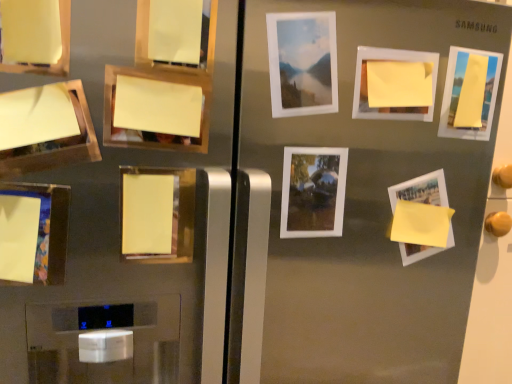
How much space does yellow matte paper at center, which appears as the fourth picture frame when viewed from the left, occupy horizontally?

It is 0.47 inches.

This screenshot has height=384, width=512. I want to click on yellow paper at upper left, arranged as the 7th picture frame when viewed from the right, so click(156, 109).

How much space does yellow matte paper at bottom right, the second picture frame when ordered from right to left, occupy vertically?

The height of yellow matte paper at bottom right, the second picture frame when ordered from right to left, is 18.59 centimeters.

This screenshot has height=384, width=512. Describe the element at coordinates (420, 192) in the screenshot. I see `yellow matte paper at bottom right, positioned as the tenth picture frame in left-to-right order` at that location.

The height and width of the screenshot is (384, 512). Find the location of `matte yellow paper at upper left, the ninth picture frame from the right`. matte yellow paper at upper left, the ninth picture frame from the right is located at coordinates (62, 49).

Where is `yellow matte paper at upper right, the 9th picture frame in the left-to-right sequence`? This screenshot has height=384, width=512. yellow matte paper at upper right, the 9th picture frame in the left-to-right sequence is located at coordinates (394, 84).

In order to click on yellow matte paper at center, which appears as the fourth picture frame when viewed from the left in this screenshot , I will do `click(157, 214)`.

Between matte yellow paper at upper left, the ninth picture frame from the right, and matte yellow paper at lower left, arranged as the 1th picture frame when viewed from the left, which one has smaller size?

matte yellow paper at lower left, arranged as the 1th picture frame when viewed from the left.

From a real-world perspective, is matte yellow paper at upper left, the ninth picture frame from the right, over matte yellow paper at lower left, which appears as the 11th picture frame when viewed from the right?

Yes, from a real-world perspective, matte yellow paper at upper left, the ninth picture frame from the right, is over matte yellow paper at lower left, which appears as the 11th picture frame when viewed from the right

At what (x,y) coordinates should I click in order to perform the action: click on the 9th picture frame positioned above the matte yellow paper at lower left, which appears as the 11th picture frame when viewed from the right (from a real-world perspective). Please return your answer as a coordinate pair (x, y). Looking at the image, I should click on (62, 49).

Is matte yellow paper at lower left, arranged as the 1th picture frame when viewed from the left, completely or partially inside matte yellow paper at upper left, the ninth picture frame from the right?

Actually, matte yellow paper at lower left, arranged as the 1th picture frame when viewed from the left, is outside matte yellow paper at upper left, the ninth picture frame from the right.

Is yellow matte paper at center, placed as the eighth picture frame when sorted from right to left, inside yellow matte paper at upper right, the 9th picture frame in the left-to-right sequence?

Definitely not — yellow matte paper at center, placed as the eighth picture frame when sorted from right to left, is not inside yellow matte paper at upper right, the 9th picture frame in the left-to-right sequence.

Would you consider yellow matte paper at upper right, positioned as the third picture frame in right-to-left order, to be distant from yellow matte paper at center, placed as the eighth picture frame when sorted from right to left?

No, yellow matte paper at upper right, positioned as the third picture frame in right-to-left order, is not far from yellow matte paper at center, placed as the eighth picture frame when sorted from right to left.

From a real-world perspective, which object stands above the other?

yellow matte paper at upper right, the 9th picture frame in the left-to-right sequence, from a real-world perspective.

Does yellow matte paper at upper right, positioned as the third picture frame in right-to-left order, lie in front of yellow matte paper at center, which appears as the fourth picture frame when viewed from the left?

That is False.

Which object is closer to the camera taking this photo, matte yellow paper at upper left, which is the 3th picture frame in left-to-right order, or yellow matte paper at center, placed as the eighth picture frame when sorted from right to left?

matte yellow paper at upper left, which is the 3th picture frame in left-to-right order.

Can you confirm if matte yellow paper at upper left, the ninth picture frame from the right, is wider than yellow matte paper at center, which appears as the fourth picture frame when viewed from the left?

Yes.

Looking at this image, from a real-world perspective, which is physically below, matte yellow paper at upper left, the ninth picture frame from the right, or yellow matte paper at center, placed as the eighth picture frame when sorted from right to left?

yellow matte paper at center, placed as the eighth picture frame when sorted from right to left.

Is matte yellow paper at upper left, the ninth picture frame from the right, turned away from yellow matte paper at center, which appears as the fourth picture frame when viewed from the left?

No.

Could you tell me if yellow matte paper at bottom right, the second picture frame when ordered from right to left, is turned towards yellow paper at upper left, arranged as the 7th picture frame when viewed from the right?

No.

From a real-world perspective, which is physically below, yellow matte paper at bottom right, the second picture frame when ordered from right to left, or yellow paper at upper left, the fifth picture frame when ordered from left to right?

From a 3D spatial view, yellow matte paper at bottom right, the second picture frame when ordered from right to left, is below.

Does yellow matte paper at bottom right, the second picture frame when ordered from right to left, have a greater width compared to yellow paper at upper left, the fifth picture frame when ordered from left to right?

Correct, the width of yellow matte paper at bottom right, the second picture frame when ordered from right to left, exceeds that of yellow paper at upper left, the fifth picture frame when ordered from left to right.

In the scene shown: From a real-world perspective, which object rests below the other?

yellow paper at upper left, arranged as the 7th picture frame when viewed from the right.

Who is more distant, white matte picture frame at upper center, the 6th picture frame from the left, or yellow paper at upper left, arranged as the 7th picture frame when viewed from the right?

yellow paper at upper left, arranged as the 7th picture frame when viewed from the right, is further away from the camera.

Considering the relative sizes of white matte picture frame at upper center, the sixth picture frame viewed from the right, and yellow paper at upper left, the fifth picture frame when ordered from left to right, in the image provided, is white matte picture frame at upper center, the sixth picture frame viewed from the right, shorter than yellow paper at upper left, the fifth picture frame when ordered from left to right,?

Incorrect, the height of white matte picture frame at upper center, the sixth picture frame viewed from the right, does not fall short of that of yellow paper at upper left, the fifth picture frame when ordered from left to right.

How many degrees apart are the facing directions of white matte picture frame at upper center, the 6th picture frame from the left, and yellow matte paper at upper right, positioned as the third picture frame in right-to-left order?

white matte picture frame at upper center, the 6th picture frame from the left, and yellow matte paper at upper right, positioned as the third picture frame in right-to-left order, are facing 2.7 degrees away from each other.

Which object is thinner, white matte picture frame at upper center, the 6th picture frame from the left, or yellow matte paper at upper right, positioned as the third picture frame in right-to-left order?

Thinner between the two is yellow matte paper at upper right, positioned as the third picture frame in right-to-left order.

Is white matte picture frame at upper center, the sixth picture frame viewed from the right, at the left side of yellow matte paper at upper right, the 9th picture frame in the left-to-right sequence?

Yes.

Is white matte picture frame at upper center, the sixth picture frame viewed from the right, inside or outside of yellow matte paper at upper right, positioned as the third picture frame in right-to-left order?

white matte picture frame at upper center, the sixth picture frame viewed from the right, cannot be found inside yellow matte paper at upper right, positioned as the third picture frame in right-to-left order.

Considering the sizes of objects yellow matte paper at upper right, which is counted as the first picture frame, starting from the right, and yellow paper at upper left, the 10th picture frame positioned from the right, in the image provided, who is thinner, yellow matte paper at upper right, which is counted as the first picture frame, starting from the right, or yellow paper at upper left, the 10th picture frame positioned from the right,?

yellow matte paper at upper right, which is counted as the first picture frame, starting from the right.

Who is more distant, yellow matte paper at upper right, which is counted as the first picture frame, starting from the right, or yellow paper at upper left, the 10th picture frame positioned from the right?

yellow matte paper at upper right, which is counted as the first picture frame, starting from the right, is behind.

The image size is (512, 384). What are the coordinates of `the 2nd picture frame located above the yellow paper at upper left, the 10th picture frame positioned from the right (from a real-world perspective)` in the screenshot? It's located at (470, 94).

Is yellow matte paper at upper right, which is counted as the first picture frame, starting from the right, to the left of yellow paper at upper left, the 10th picture frame positioned from the right, from the viewer's perspective?

In fact, yellow matte paper at upper right, which is counted as the first picture frame, starting from the right, is to the right of yellow paper at upper left, the 10th picture frame positioned from the right.

From a real-world perspective, starting from the matte yellow paper at lower left, arranged as the 1th picture frame when viewed from the left, which picture frame is the 9th one vertically above it? Please provide its 2D coordinates.

[(62, 49)]

Image resolution: width=512 pixels, height=384 pixels. What are the coordinates of `the 1st picture frame in front when counting from the yellow matte paper at upper right, positioned as the third picture frame in right-to-left order` in the screenshot? It's located at (157, 214).

Considering their positions, is yellow matte paper at bottom right, the second picture frame when ordered from right to left, positioned further to yellow paper at upper left, the 10th picture frame positioned from the right, than white matte picture frame at upper center, the 6th picture frame from the left?

Based on the image, yellow matte paper at bottom right, the second picture frame when ordered from right to left, appears to be further to yellow paper at upper left, the 10th picture frame positioned from the right.

Looking at the image, which one is located closer to yellow paper at upper left, arranged as the 7th picture frame when viewed from the right, yellow matte paper at center, placed as the eighth picture frame when sorted from right to left, or matte yellow paper at lower left, arranged as the 1th picture frame when viewed from the left?

yellow matte paper at center, placed as the eighth picture frame when sorted from right to left.

Estimate the real-world distances between objects in this image. Which object is further from yellow matte paper at upper right, which is counted as the eleventh picture frame, starting from the left, yellow matte paper at center, which appears as the fourth picture frame when viewed from the left, or matte yellow paper at lower left, which appears as the 11th picture frame when viewed from the right?

Among the two, matte yellow paper at lower left, which appears as the 11th picture frame when viewed from the right, is located further to yellow matte paper at upper right, which is counted as the eleventh picture frame, starting from the left.

When comparing their distances from yellow matte paper at upper right, which is counted as the eleventh picture frame, starting from the left, does matte yellow paper at lower left, arranged as the 1th picture frame when viewed from the left, or matte white picture frame at upper center, which is counted as the 5th picture frame, starting from the right, seem closer?

Based on the image, matte white picture frame at upper center, which is counted as the 5th picture frame, starting from the right, appears to be nearer to yellow matte paper at upper right, which is counted as the eleventh picture frame, starting from the left.

Based on their spatial positions, is white matte picture frame at center, the 8th picture frame viewed from the left, or yellow matte paper at center, which appears as the fourth picture frame when viewed from the left, further from yellow matte paper at upper right, which is counted as the eleventh picture frame, starting from the left?

yellow matte paper at center, which appears as the fourth picture frame when viewed from the left, lies further to yellow matte paper at upper right, which is counted as the eleventh picture frame, starting from the left, than the other object.

Which object lies further to the anchor point matte white picture frame at upper center, which is counted as the 5th picture frame, starting from the right, yellow paper at upper left, which appears as the 2th picture frame when viewed from the left, or matte yellow paper at upper left, the ninth picture frame from the right?

matte yellow paper at upper left, the ninth picture frame from the right, lies further to matte white picture frame at upper center, which is counted as the 5th picture frame, starting from the right, than the other object.

Considering their positions, is yellow matte paper at center, which appears as the fourth picture frame when viewed from the left, positioned further to yellow matte paper at upper right, which is counted as the first picture frame, starting from the right, than yellow paper at upper left, which appears as the 2th picture frame when viewed from the left?

Based on the image, yellow paper at upper left, which appears as the 2th picture frame when viewed from the left, appears to be further to yellow matte paper at upper right, which is counted as the first picture frame, starting from the right.

Looking at the image, which one is located closer to white matte picture frame at center, the 8th picture frame viewed from the left, matte yellow paper at lower left, which appears as the 11th picture frame when viewed from the right, or white matte picture frame at upper center, the sixth picture frame viewed from the right?

Based on the image, white matte picture frame at upper center, the sixth picture frame viewed from the right, appears to be nearer to white matte picture frame at center, the 8th picture frame viewed from the left.

The height and width of the screenshot is (384, 512). What are the coordinates of `picture frame between yellow paper at upper left, the fifth picture frame when ordered from left to right, and matte white picture frame at upper center, which is counted as the 5th picture frame, starting from the right, from left to right` in the screenshot? It's located at click(175, 34).